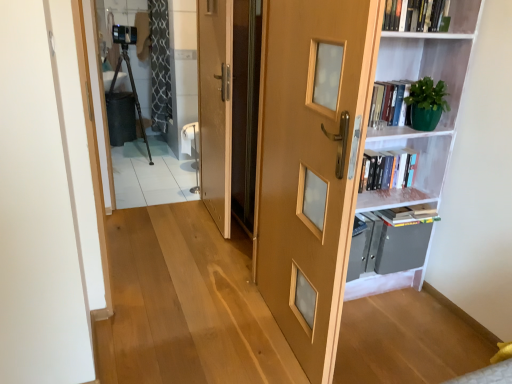
The image size is (512, 384). I want to click on vacant space in front of white matte bookshelf at right, so click(396, 339).